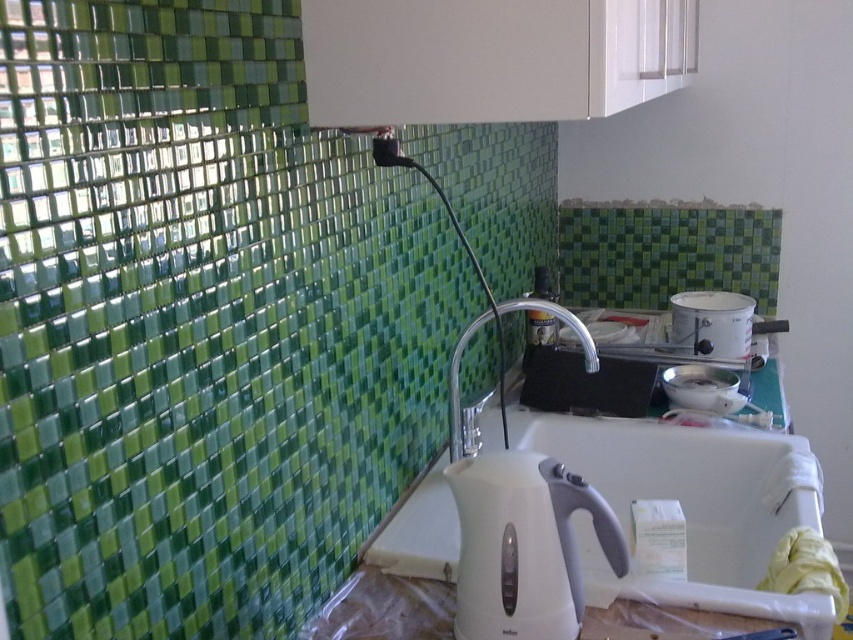
Question: Among these points, which one is nearest to the camera?

Choices:
 (A) (589, 355)
 (B) (720, 323)
 (C) (338, 381)
 (D) (726, 387)

Answer: (C)

Question: Can you confirm if green mosaic tile at upper left is positioned to the right of clear metallic faucet at center?

Choices:
 (A) no
 (B) yes

Answer: (A)

Question: Estimate the real-world distances between objects in this image. Which object is closer to the green mosaic tile at upper left?

Choices:
 (A) white glossy bowl at upper right
 (B) white plastic kettle at center
 (C) white glossy pot at upper right

Answer: (B)

Question: Is green mosaic tile at upper left above white glossy pot at upper right?

Choices:
 (A) no
 (B) yes

Answer: (B)

Question: Which point appears closest to the camera in this image?

Choices:
 (A) (734, 388)
 (B) (519, 561)
 (C) (575, 330)
 (D) (140, 524)

Answer: (D)

Question: Considering the relative positions of white plastic kettle at center and white glossy bowl at upper right in the image provided, where is white plastic kettle at center located with respect to white glossy bowl at upper right?

Choices:
 (A) above
 (B) below

Answer: (B)